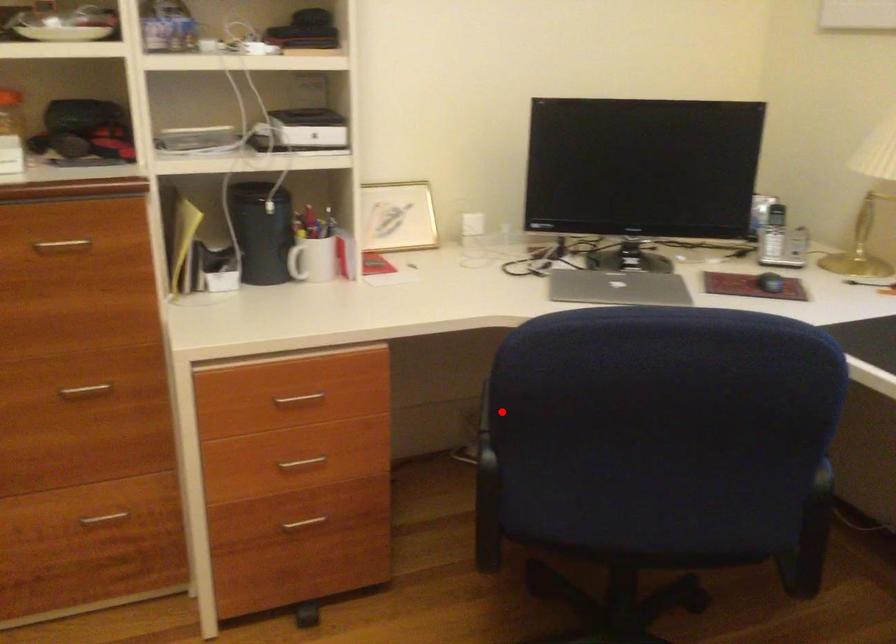
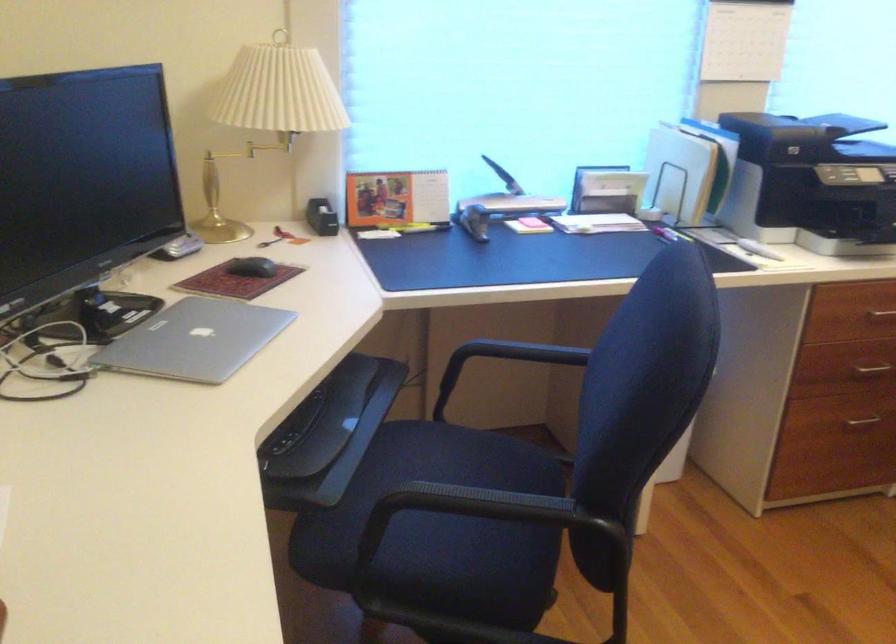
Find the pixel in the second image that matches the highlighted location in the first image.

(458, 511)